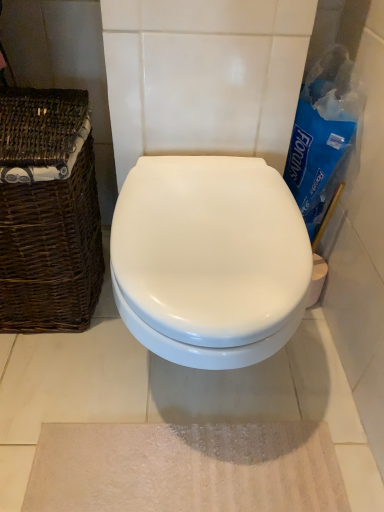
The width and height of the screenshot is (384, 512). What are the coordinates of `vacant point above white glossy toilet at center (from a real-world perspective)` in the screenshot? It's located at (208, 182).